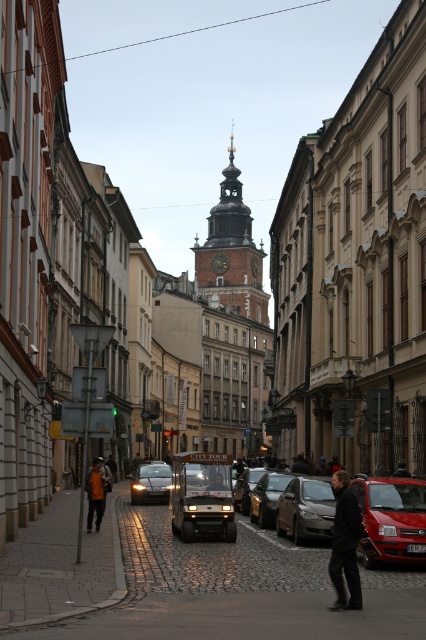
From the picture: You are standing on the cobblestone street in the bustling urban scene. You notice two points marked in the image. Which point, point (351, 497) or point (210, 237), is closer to you?

Point (351, 497) is closer to the viewer than point (210, 237).

You are a photographer planning to take a photo of the shiny red car at lower right and the dark brown leather jacket at center in the European city scene. Since you want both subjects to appear balanced in the frame, which object should you position closer to the camera to achieve this?

To balance the subjects in the frame, position the dark brown leather jacket at center closer to the camera since the shiny red car at lower right is larger in size and would appear smaller if placed farther away.